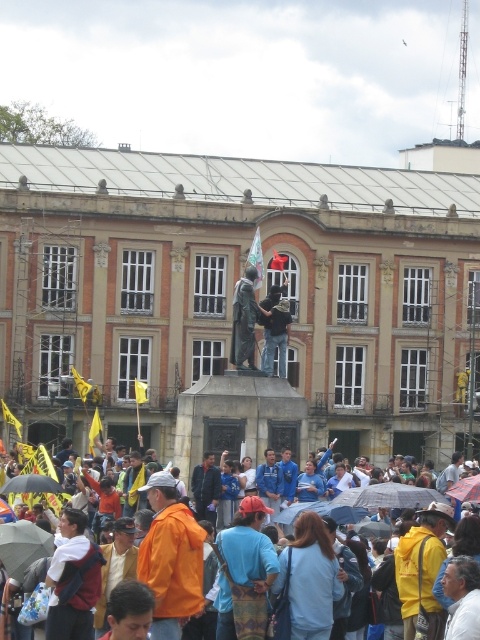
You are a photographer standing at the back of the crowd. You want to take a photo of the transparent plastic umbrella at center without the blue fabric crowd at center blocking it. Is this possible?

The blue fabric crowd at center is in front of the transparent plastic umbrella at center, so the crowd will block the view of the umbrella. You cannot take a photo of the transparent plastic umbrella at center without the blue fabric crowd at center blocking it.

You are a photographer trying to capture a clear shot of both the matte bronze statue at center and the transparent plastic umbrella at center. Given their sizes, which object might you need to position closer to the camera to ensure both fit in the frame?

The matte bronze statue at center has a lesser width compared to the transparent plastic umbrella at center. To ensure both fit in the frame, you might position the matte bronze statue at center closer to the camera since it is narrower, allowing the wider transparent plastic umbrella at center to be captured without cropping.

You are a photographer trying to capture a clear shot of the matte bronze statue at center without any obstructions. Since you are standing at the same level as the transparent plastic umbrella at center, can you still see the statue clearly?

The matte bronze statue at center is positioned over the transparent plastic umbrella at center, so yes, you can still see the statue clearly as it is above the umbrella.